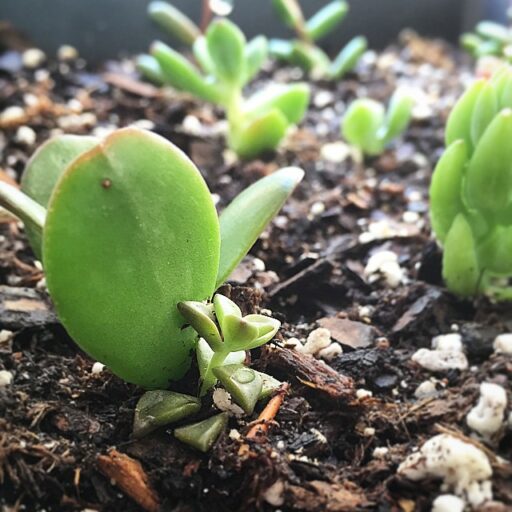
Find the location of a particular element. This screenshot has height=512, width=512. succulent plant is located at coordinates (153, 279), (492, 183), (238, 354), (272, 114).